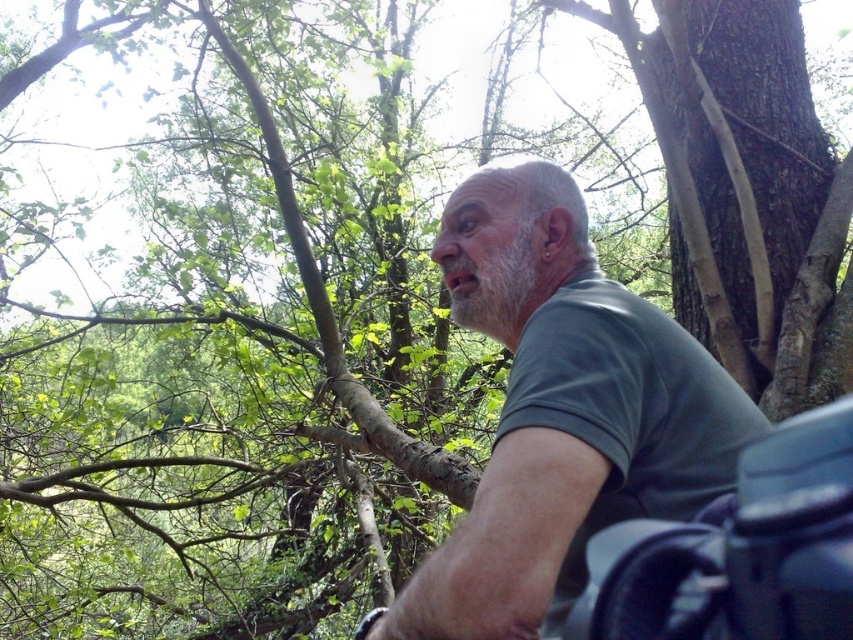
Question: Can you confirm if green matte shirt at center is wider than black rubber motorcycle at lower right?

Choices:
 (A) no
 (B) yes

Answer: (B)

Question: Does green matte shirt at center appear on the right side of black rubber motorcycle at lower right?

Choices:
 (A) no
 (B) yes

Answer: (A)

Question: Can you confirm if green matte shirt at center is positioned below black rubber motorcycle at lower right?

Choices:
 (A) no
 (B) yes

Answer: (A)

Question: Which point appears closest to the camera in this image?

Choices:
 (A) (428, 576)
 (B) (796, 548)

Answer: (B)